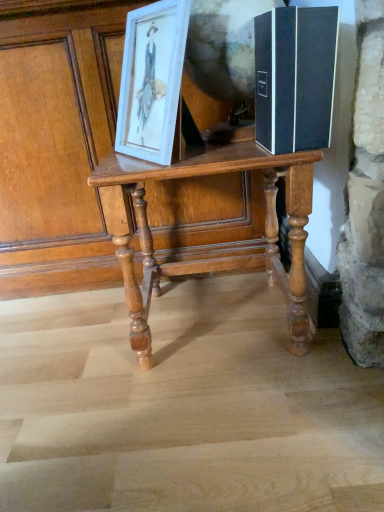
Question: Are black matte book at right and wooden table at center beside each other?

Choices:
 (A) yes
 (B) no

Answer: (B)

Question: Does black matte book at right have a lesser width compared to wooden table at center?

Choices:
 (A) yes
 (B) no

Answer: (A)

Question: Considering the relative positions of black matte book at right and wooden table at center in the image provided, is black matte book at right behind wooden table at center?

Choices:
 (A) no
 (B) yes

Answer: (A)

Question: Is black matte book at right closer to the viewer compared to wooden table at center?

Choices:
 (A) yes
 (B) no

Answer: (A)

Question: Does black matte book at right appear on the right side of wooden table at center?

Choices:
 (A) no
 (B) yes

Answer: (B)

Question: Would you say black matte book at right is to the left or to the right of white wood picture frame at upper left in the picture?

Choices:
 (A) left
 (B) right

Answer: (B)

Question: Is black matte book at right in front of or behind white wood picture frame at upper left in the image?

Choices:
 (A) front
 (B) behind

Answer: (A)

Question: Is black matte book at right bigger or smaller than white wood picture frame at upper left?

Choices:
 (A) small
 (B) big

Answer: (A)

Question: From the image's perspective, relative to white wood picture frame at upper left, is black matte book at right above or below?

Choices:
 (A) below
 (B) above

Answer: (A)

Question: In terms of size, does black matte book at right appear bigger or smaller than wooden table at center?

Choices:
 (A) big
 (B) small

Answer: (B)

Question: From the image's perspective, is black matte book at right above or below wooden table at center?

Choices:
 (A) below
 (B) above

Answer: (B)

Question: Looking at their shapes, would you say black matte book at right is wider or thinner than wooden table at center?

Choices:
 (A) thin
 (B) wide

Answer: (A)

Question: Is black matte book at right taller or shorter than wooden table at center?

Choices:
 (A) tall
 (B) short

Answer: (B)

Question: In terms of width, does white wood picture frame at upper left look wider or thinner when compared to black matte book at right?

Choices:
 (A) wide
 (B) thin

Answer: (B)

Question: Is white wood picture frame at upper left inside or outside of black matte book at right?

Choices:
 (A) inside
 (B) outside

Answer: (B)